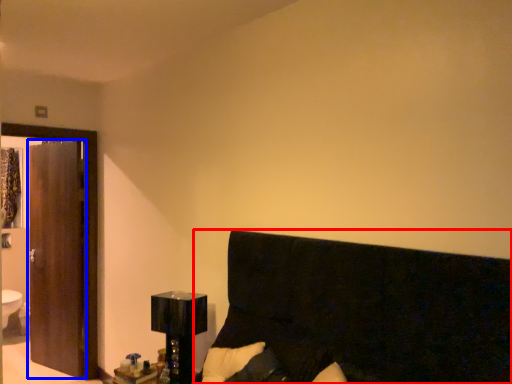
Question: Which object is further to the camera taking this photo, furniture (highlighted by a red box) or screen door (highlighted by a blue box)?

Choices:
 (A) furniture
 (B) screen door

Answer: (B)